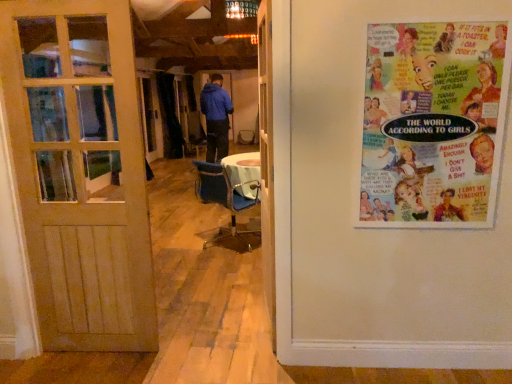
Question: From the image's perspective, does colorful paper poster at upper right appear higher than blue fabric chair at center?

Choices:
 (A) yes
 (B) no

Answer: (A)

Question: Is colorful paper poster at upper right at the left side of blue fabric chair at center?

Choices:
 (A) no
 (B) yes

Answer: (A)

Question: Is colorful paper poster at upper right at the right side of blue fabric chair at center?

Choices:
 (A) no
 (B) yes

Answer: (B)

Question: Is colorful paper poster at upper right touching blue fabric chair at center?

Choices:
 (A) yes
 (B) no

Answer: (B)

Question: Is colorful paper poster at upper right closer to the viewer compared to blue fabric chair at center?

Choices:
 (A) yes
 (B) no

Answer: (A)

Question: Are colorful paper poster at upper right and blue fabric chair at center far apart?

Choices:
 (A) yes
 (B) no

Answer: (A)

Question: Is colorful paper poster at upper right taller than wooden door at left, placed as the second door when sorted from right to left?

Choices:
 (A) no
 (B) yes

Answer: (A)

Question: Is colorful paper poster at upper right to the right of wooden door at left, which is the 1th door in left-to-right order, from the viewer's perspective?

Choices:
 (A) yes
 (B) no

Answer: (A)

Question: From the image's perspective, is colorful paper poster at upper right under wooden door at left, which is the 1th door in left-to-right order?

Choices:
 (A) no
 (B) yes

Answer: (A)

Question: Considering the relative sizes of colorful paper poster at upper right and wooden door at left, placed as the second door when sorted from right to left, in the image provided, is colorful paper poster at upper right bigger than wooden door at left, placed as the second door when sorted from right to left,?

Choices:
 (A) no
 (B) yes

Answer: (A)

Question: Is wooden door at left, which is the 1th door in left-to-right order, at the back of colorful paper poster at upper right?

Choices:
 (A) yes
 (B) no

Answer: (B)

Question: Does colorful paper poster at upper right lie behind wooden door at left, placed as the second door when sorted from right to left?

Choices:
 (A) no
 (B) yes

Answer: (A)

Question: From a real-world perspective, does blue fabric chair at center sit lower than white wooden door at center, the first door from the right?

Choices:
 (A) yes
 (B) no

Answer: (A)